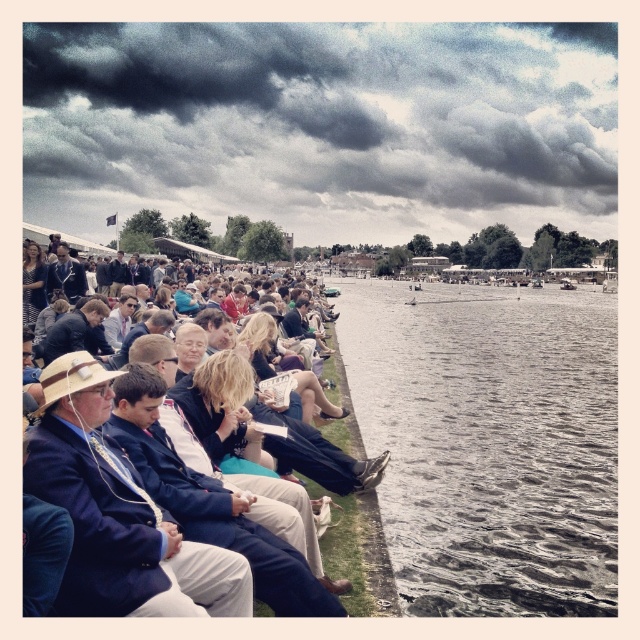
You are standing on the riverbank and see the gray water at center and the dark blue suit at center. Which object appears taller from your viewpoint?

The gray water at center appears taller than the dark blue suit at center because it has a greater height compared to it according to the description.